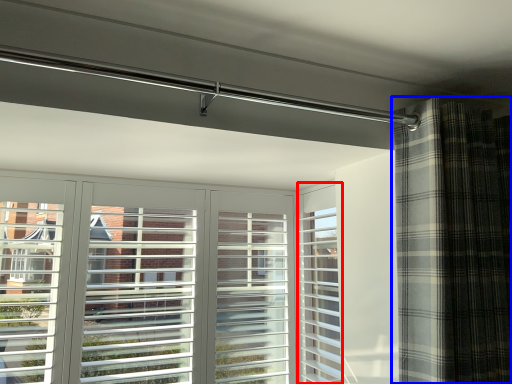
Question: Which object is further to the camera taking this photo, screen door (highlighted by a red box) or curtain (highlighted by a blue box)?

Choices:
 (A) screen door
 (B) curtain

Answer: (A)